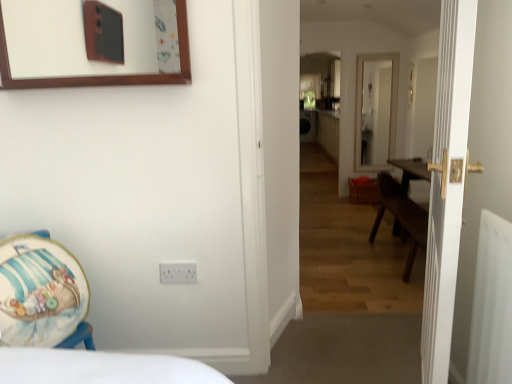
Question: Considering the relative sizes of white wooden door at right and white plastic radiator at right in the image provided, is white wooden door at right wider than white plastic radiator at right?

Choices:
 (A) yes
 (B) no

Answer: (B)

Question: Considering the relative sizes of white wooden door at right and white plastic radiator at right in the image provided, is white wooden door at right thinner than white plastic radiator at right?

Choices:
 (A) yes
 (B) no

Answer: (A)

Question: Can you confirm if white wooden door at right is bigger than white plastic radiator at right?

Choices:
 (A) yes
 (B) no

Answer: (A)

Question: Considering the relative sizes of white wooden door at right and white plastic radiator at right in the image provided, is white wooden door at right smaller than white plastic radiator at right?

Choices:
 (A) no
 (B) yes

Answer: (A)

Question: Is white wooden door at right shorter than white plastic radiator at right?

Choices:
 (A) yes
 (B) no

Answer: (B)

Question: Visually, is wooden floor at center positioned to the left or to the right of wooden armchair at lower left?

Choices:
 (A) right
 (B) left

Answer: (A)

Question: From the image's perspective, is wooden floor at center located above or below wooden armchair at lower left?

Choices:
 (A) above
 (B) below

Answer: (A)

Question: Is wooden floor at center inside or outside of wooden armchair at lower left?

Choices:
 (A) outside
 (B) inside

Answer: (A)

Question: Considering the positions of point (320, 61) and point (53, 314), is point (320, 61) closer or farther from the camera than point (53, 314)?

Choices:
 (A) closer
 (B) farther

Answer: (B)

Question: Relative to white plastic electric outlet at lower center, is wooden floor at center in front or behind?

Choices:
 (A) behind
 (B) front

Answer: (B)

Question: Considering the positions of point coord(328,43) and point coord(189,268), is point coord(328,43) closer or farther from the camera than point coord(189,268)?

Choices:
 (A) closer
 (B) farther

Answer: (B)

Question: Considering the positions of wooden floor at center and white plastic electric outlet at lower center in the image, is wooden floor at center taller or shorter than white plastic electric outlet at lower center?

Choices:
 (A) tall
 (B) short

Answer: (A)

Question: From the image's perspective, is wooden floor at center located above or below white plastic electric outlet at lower center?

Choices:
 (A) below
 (B) above

Answer: (B)

Question: Is point pos(455,21) closer or farther from the camera than point pos(479,261)?

Choices:
 (A) closer
 (B) farther

Answer: (A)

Question: In terms of height, does white wooden door at right look taller or shorter compared to white plastic radiator at right?

Choices:
 (A) tall
 (B) short

Answer: (A)